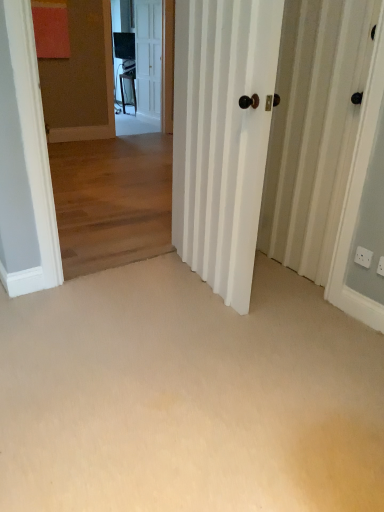
Where is `free space on the front side of wooden floor at center, the 1th corridor when ordered from top to bottom`? The width and height of the screenshot is (384, 512). free space on the front side of wooden floor at center, the 1th corridor when ordered from top to bottom is located at coordinates (127, 298).